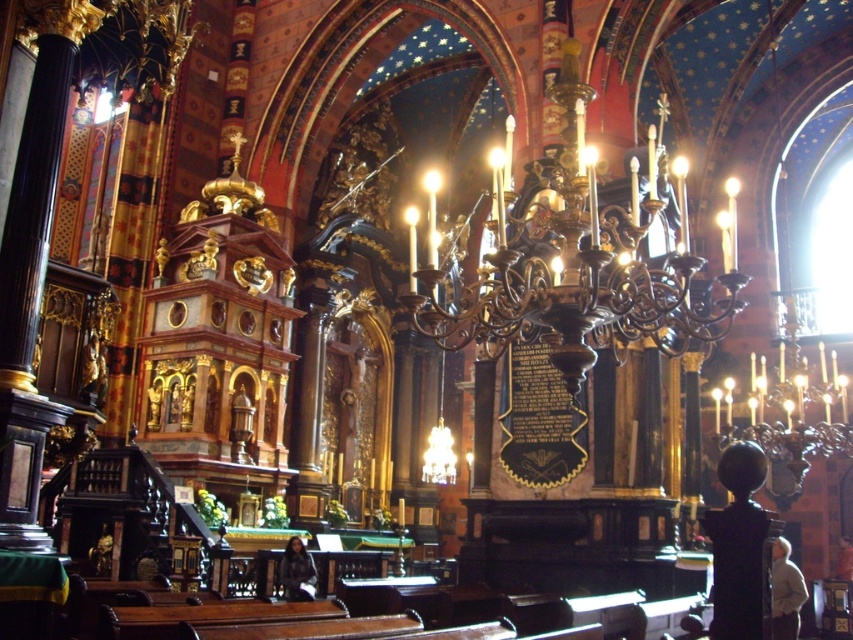
You are standing in the grand church and see both the light beige sweater at lower right and the dark gray fabric jacket at lower center. Which one is positioned more to the right side of the scene?

The light beige sweater at lower right is positioned more to the right side of the scene compared to the dark gray fabric jacket at lower center.

Based on the photo, you are standing in the grand church and want to take a photo. You notice two points in the scene labeled as point (776, 556) and point (292, 598). Which point will appear larger in your camera view?

Point (776, 556) is closer to the camera than point (292, 598), so it will appear larger in the camera view.

You are an interior designer assessing the placement of clothing items in the church. The light beige sweater at lower right and the dark gray fabric jacket at lower center are both draped over chairs. Which clothing item takes up more space on its chair?

The light beige sweater at lower right has a larger size compared to the dark gray fabric jacket at lower center, so it takes up more space on its chair.